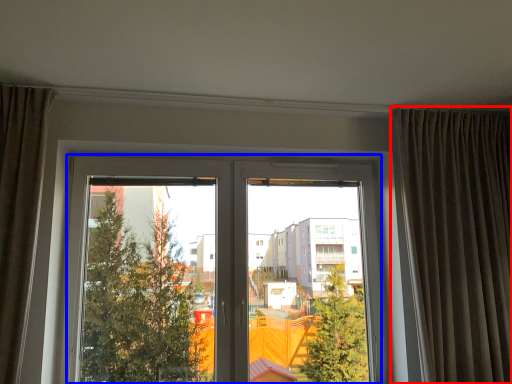
Question: Among these objects, which one is nearest to the camera, curtain (highlighted by a red box) or window (highlighted by a blue box)?

Choices:
 (A) curtain
 (B) window

Answer: (A)